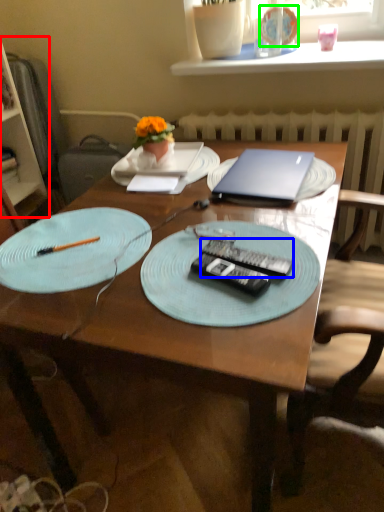
Question: Which object is the closest to the bookshelf (highlighted by a red box)? Choose among these: remote control (highlighted by a blue box) or tableware (highlighted by a green box).

Choices:
 (A) remote control
 (B) tableware

Answer: (B)